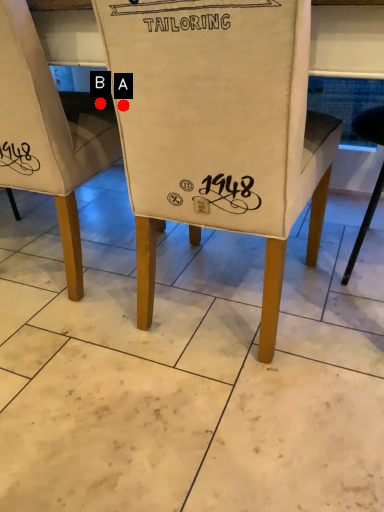
Question: Two points are circled on the image, labeled by A and B beside each circle. Which point is closer to the camera?

Choices:
 (A) A is closer
 (B) B is closer

Answer: (A)